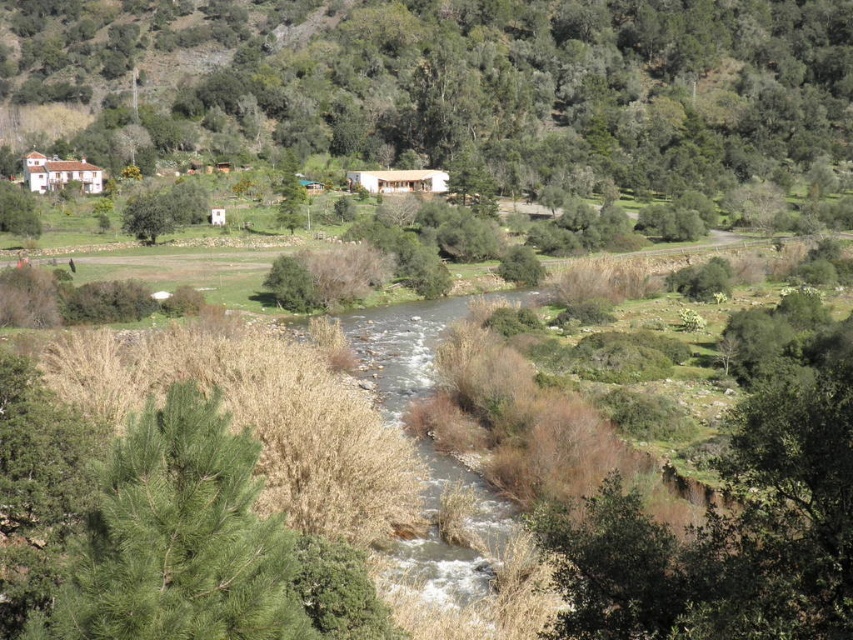
You are an ornithologist observing the green leafy tree at upper left and the green matte tree at upper left in the image. Which tree is taller?

The green leafy tree at upper left is much taller than the green matte tree at upper left.